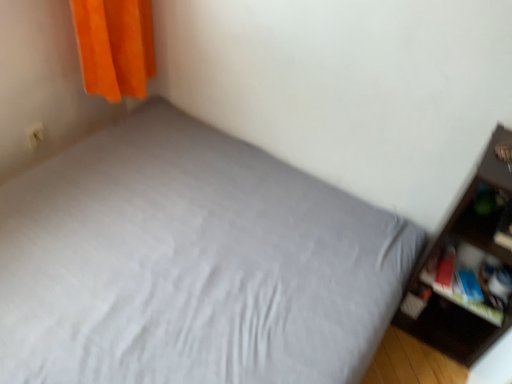
Question: Is the depth of gray fabric bed at center greater than that of matte plastic cabinet at right?

Choices:
 (A) no
 (B) yes

Answer: (A)

Question: Is the surface of gray fabric bed at center in direct contact with matte plastic cabinet at right?

Choices:
 (A) no
 (B) yes

Answer: (A)

Question: Considering the relative sizes of gray fabric bed at center and matte plastic cabinet at right in the image provided, is gray fabric bed at center wider than matte plastic cabinet at right?

Choices:
 (A) no
 (B) yes

Answer: (B)

Question: Considering the relative positions of gray fabric bed at center and matte plastic cabinet at right in the image provided, is gray fabric bed at center to the left of matte plastic cabinet at right from the viewer's perspective?

Choices:
 (A) yes
 (B) no

Answer: (A)

Question: Considering the relative sizes of gray fabric bed at center and matte plastic cabinet at right in the image provided, is gray fabric bed at center smaller than matte plastic cabinet at right?

Choices:
 (A) no
 (B) yes

Answer: (A)

Question: Is gray fabric bed at center situated inside matte dark brown shelf at right or outside?

Choices:
 (A) inside
 (B) outside

Answer: (B)

Question: Based on their sizes in the image, would you say gray fabric bed at center is bigger or smaller than matte dark brown shelf at right?

Choices:
 (A) small
 (B) big

Answer: (B)

Question: From a real-world perspective, is gray fabric bed at center above or below matte dark brown shelf at right?

Choices:
 (A) below
 (B) above

Answer: (A)

Question: From the image's perspective, is gray fabric bed at center positioned above or below matte dark brown shelf at right?

Choices:
 (A) above
 (B) below

Answer: (B)

Question: Is point (412, 296) positioned closer to the camera than point (446, 264)?

Choices:
 (A) farther
 (B) closer

Answer: (A)

Question: From the image's perspective, is matte dark brown shelf at right positioned above or below matte plastic cabinet at right?

Choices:
 (A) below
 (B) above

Answer: (B)

Question: Is matte dark brown shelf at right in front of or behind matte plastic cabinet at right in the image?

Choices:
 (A) behind
 (B) front

Answer: (B)

Question: Is matte dark brown shelf at right taller or shorter than matte plastic cabinet at right?

Choices:
 (A) short
 (B) tall

Answer: (B)

Question: In terms of height, does gray fabric bed at center look taller or shorter compared to matte plastic cabinet at right?

Choices:
 (A) tall
 (B) short

Answer: (A)

Question: Looking at their shapes, would you say gray fabric bed at center is wider or thinner than matte plastic cabinet at right?

Choices:
 (A) thin
 (B) wide

Answer: (B)